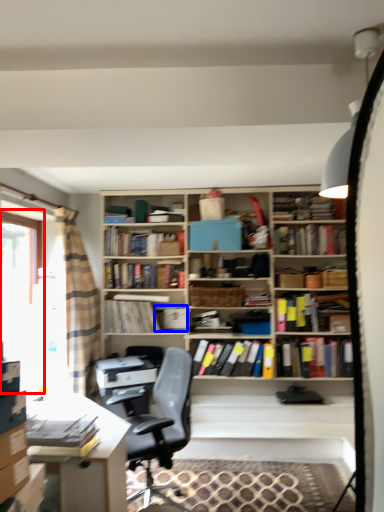
Question: Which point is further to the camera, window screen (highlighted by a red box) or book (highlighted by a blue box)?

Choices:
 (A) window screen
 (B) book

Answer: (B)